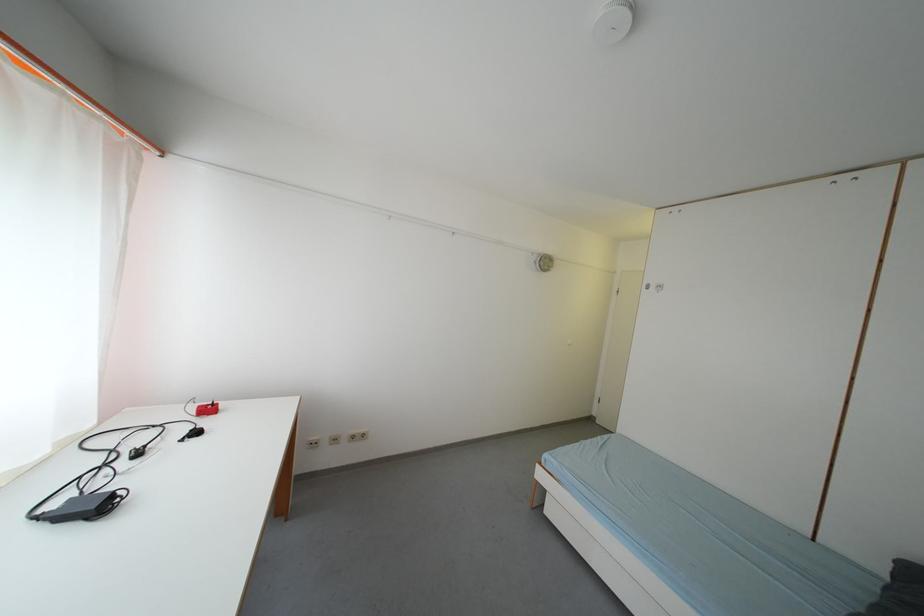
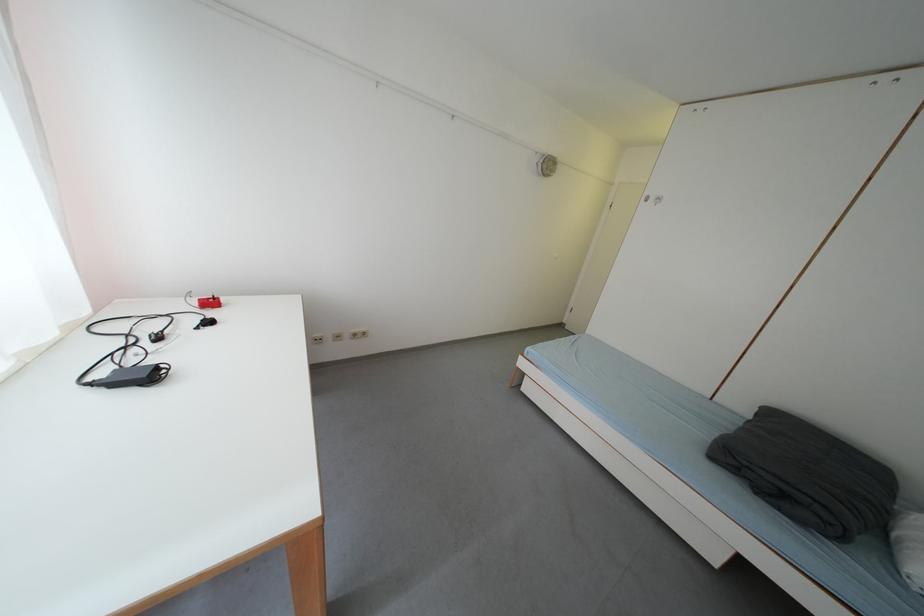
Question: How did the camera likely rotate?

Choices:
 (A) Left
 (B) Right
 (C) Up
 (D) Down

Answer: (D)